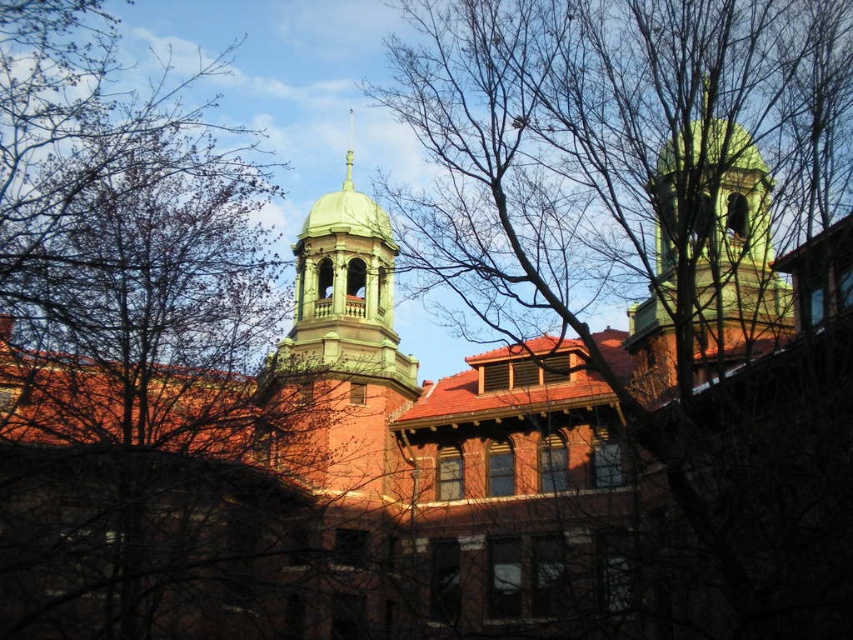
Can you confirm if bare branches at upper center is wider than green polished spire at upper center?

Indeed, bare branches at upper center has a greater width compared to green polished spire at upper center.

Does point (642, 406) come closer to viewer compared to point (347, 132)?

Yes, it is in front of point (347, 132).

Is point (691, 189) positioned behind point (344, 176)?

No.

Where is `bare branches at upper center`? bare branches at upper center is located at coordinates (654, 266).

Is the position of bare branches at upper left less distant than that of bare branches at upper center?

No, bare branches at upper left is behind bare branches at upper center.

Can you confirm if bare branches at upper left is thinner than bare branches at upper center?

Correct, bare branches at upper left's width is less than bare branches at upper center's.

Identify the location of bare branches at upper left. (175, 369).

Is bare branches at upper left above green polished spire at upper center?

Incorrect, bare branches at upper left is not positioned above green polished spire at upper center.

Who is more distant from viewer, (108, 40) or (351, 176)?

The point (351, 176) is behind.

At what (x,y) coordinates should I click in order to perform the action: click on bare branches at upper left. Please return your answer as a coordinate pair (x, y). This screenshot has width=853, height=640. Looking at the image, I should click on (175, 369).